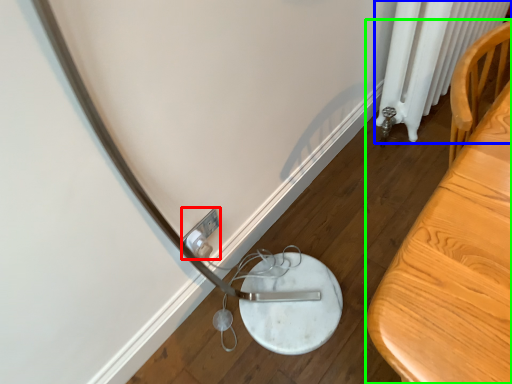
Question: Estimate the real-world distances between objects in this image. Which object is farther from electric outlet (highlighted by a red box), radiator (highlighted by a blue box) or furniture (highlighted by a green box)?

Choices:
 (A) radiator
 (B) furniture

Answer: (A)